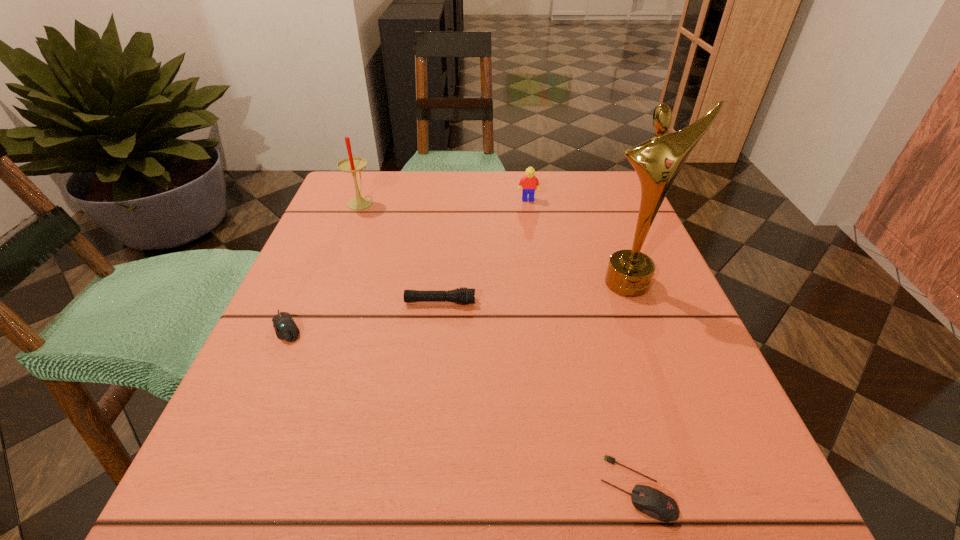
Identify the location of computer mouse that is at the left edge. The height and width of the screenshot is (540, 960). (285, 327).

In order to click on award present at the right edge in this screenshot , I will do `click(657, 161)`.

Where is `mouse that is at the right edge`? This screenshot has height=540, width=960. mouse that is at the right edge is located at coordinates (650, 501).

Locate an element on the screen. The image size is (960, 540). object present at the far left corner is located at coordinates (352, 164).

You are a GUI agent. You are given a task and a screenshot of the screen. Output one action in this format:
    pyautogui.click(x=<x>, y=<y>)
    Task: Click on the object that is at the near right corner
    The height and width of the screenshot is (540, 960).
    Given the screenshot: What is the action you would take?
    pyautogui.click(x=650, y=501)

In the image, there is a desktop. Find the location of `free space at the far edge`. free space at the far edge is located at coordinates (454, 191).

Identify the location of vacant space at the near edge. Image resolution: width=960 pixels, height=540 pixels. (606, 485).

Image resolution: width=960 pixels, height=540 pixels. What are the coordinates of `free space at the left edge of the desktop` in the screenshot? It's located at 348,285.

Identify the location of vacant region at the right edge of the desktop. (694, 364).

Find the location of a particular element. vacant space at the far left corner of the desktop is located at coordinates (360, 216).